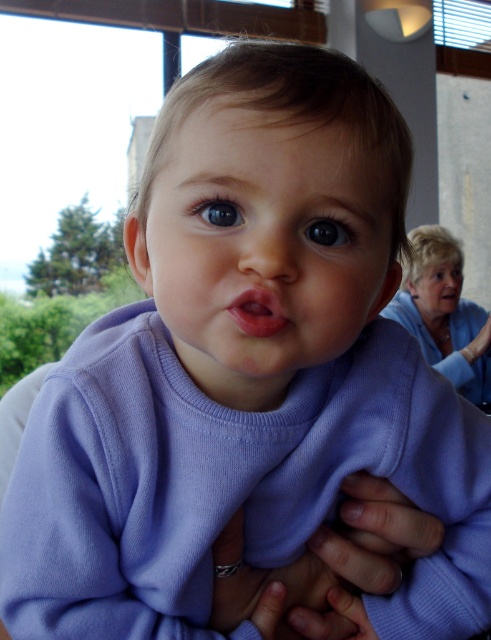
Is point (169, 202) positioned after point (454, 264)?

That is False.

Can you confirm if purple soft fabric baby at center is smaller than smooth skin face at right?

Actually, purple soft fabric baby at center might be larger than smooth skin face at right.

Find the location of a particular element. purple soft fabric baby at center is located at coordinates (263, 244).

Does smooth skin face at right have a greater width compared to pink glossy lips at center?

Yes.

Is smooth skin face at right to the left of pink glossy lips at center from the viewer's perspective?

No, smooth skin face at right is not to the left of pink glossy lips at center.

Does point (427, 323) come in front of point (258, 310)?

No, (427, 323) is behind (258, 310).

Find the location of a particular element. smooth skin face at right is located at coordinates (436, 291).

Does purple soft fabric baby at center have a larger size compared to pink glossy lips at center?

Indeed, purple soft fabric baby at center has a larger size compared to pink glossy lips at center.

Can you confirm if purple soft fabric baby at center is smaller than pink glossy lips at center?

Incorrect, purple soft fabric baby at center is not smaller in size than pink glossy lips at center.

Is point (302, 292) closer to viewer compared to point (267, 296)?

No.

What are the coordinates of `purple soft fabric baby at center` in the screenshot? It's located at (263, 244).